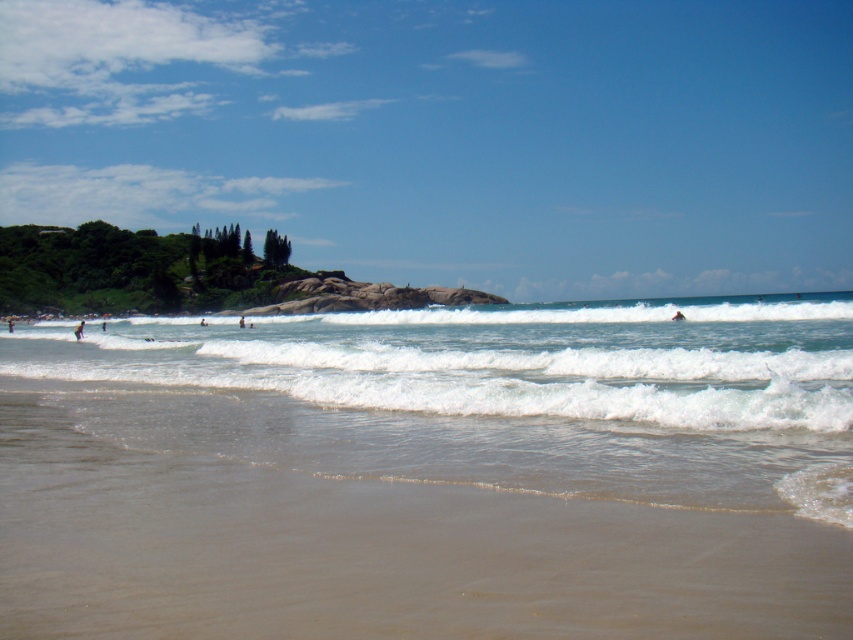
You are a photographer on the beach and want to capture both the dark blue skin at lower left and the dark brown surfboard at left in the same frame. Based on their positions, which object should you adjust your camera to focus on first to ensure both are in the shot?

The dark blue skin at lower left is positioned on the right side of the dark brown surfboard at left, so you should focus on the dark brown surfboard at left first to ensure both are included in the frame.

You are a photographer trying to capture the dark brown surfboard at left and the transparent blue sky at upper center in the same frame. Which object should you adjust your camera to focus on first if you want to include both in your shot?

The dark brown surfboard at left should be focused on first because the transparent blue sky at upper center is positioned on the right side of it, allowing the photographer to frame both elements by starting with the surfboard and adjusting the view to include the sky.